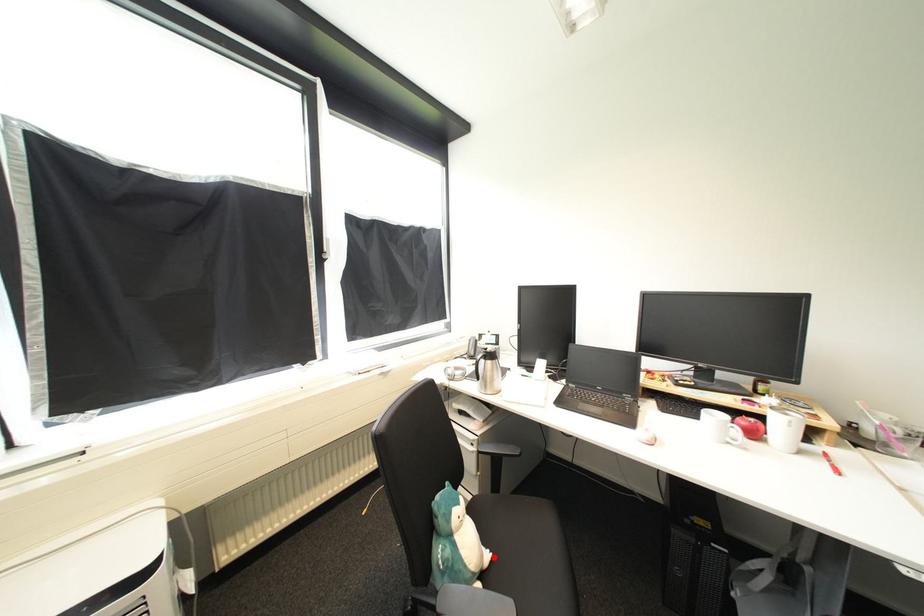
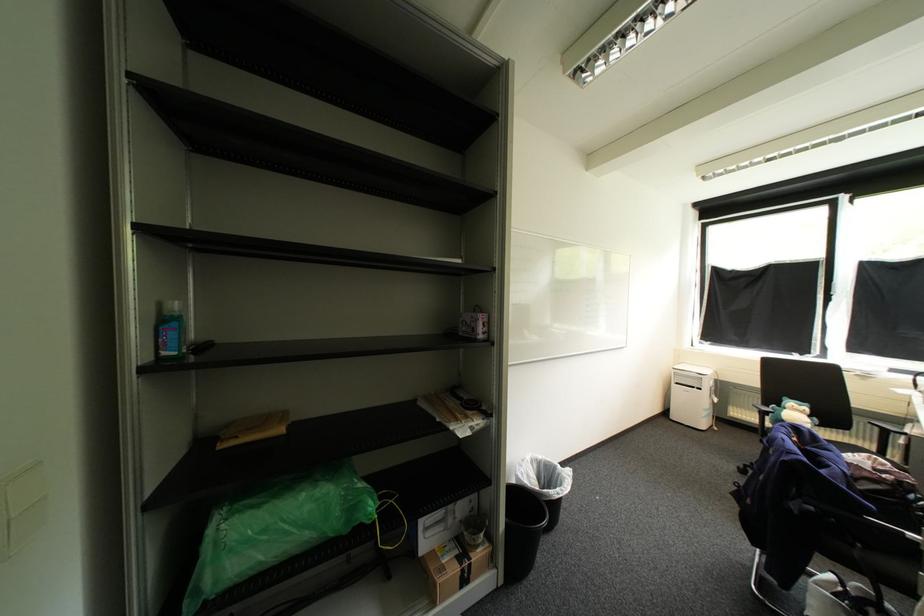
Question: I am providing you with two images of the same scene from different viewpoints. A red point is marked on the first image. Can you still see the location of the red point in image 2?

Choices:
 (A) Yes
 (B) No

Answer: (A)